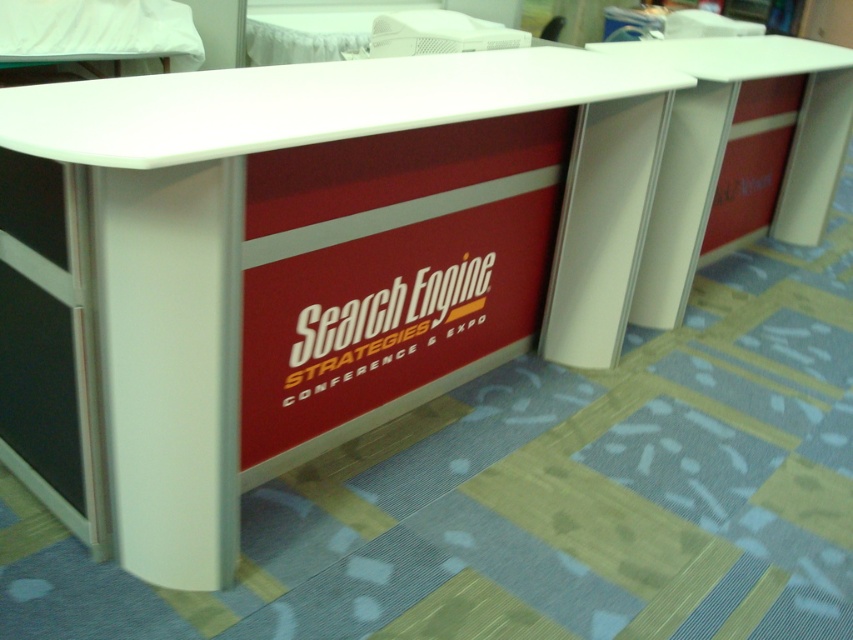
Who is taller, white glossy information desk at center or white plastic table at right?

white plastic table at right is taller.

The width and height of the screenshot is (853, 640). Describe the element at coordinates (318, 260) in the screenshot. I see `white glossy information desk at center` at that location.

Is point (425, 356) behind point (662, 184)?

No, (425, 356) is closer to viewer.

What are the coordinates of `white glossy information desk at center` in the screenshot? It's located at (318, 260).